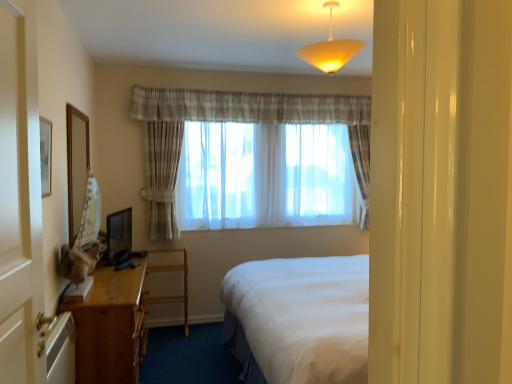
What do you see at coordinates (172, 271) in the screenshot? I see `wooden desk at lower left` at bounding box center [172, 271].

Locate an element on the screen. matte yellow glass lampshade at upper center is located at coordinates (330, 49).

Locate an element on the screen. This screenshot has width=512, height=384. wooden desk at lower left is located at coordinates (172, 271).

From a real-world perspective, is sheer fabric curtains at center on wooden mirror at left?

No, from a real-world perspective, sheer fabric curtains at center is not on top of wooden mirror at left.

Can you confirm if sheer fabric curtains at center is taller than wooden mirror at left?

Yes.

Which object is further away from the camera, sheer fabric curtains at center or wooden mirror at left?

sheer fabric curtains at center is more distant.

Would you say wooden desk at left is a long distance from white wood screen door at left?

Indeed, wooden desk at left is not near white wood screen door at left.

Which object is thinner, wooden desk at left or white wood screen door at left?

With smaller width is white wood screen door at left.

Considering the sizes of objects wooden desk at left and white wood screen door at left in the image provided, who is bigger, wooden desk at left or white wood screen door at left?

Bigger between the two is wooden desk at left.

The height and width of the screenshot is (384, 512). What are the coordinates of `screen door in front of the wooden desk at left` in the screenshot? It's located at click(20, 199).

Would you say wooden desk at lower left is to the left or to the right of white wood screen door at left in the picture?

In the image, wooden desk at lower left appears on the left side of white wood screen door at left.

In terms of size, does wooden desk at lower left appear bigger or smaller than white wood screen door at left?

Considering their sizes, wooden desk at lower left takes up more space than white wood screen door at left.

Is wooden desk at lower left oriented towards white wood screen door at left?

Yes, wooden desk at lower left is aimed at white wood screen door at left.

Which is behind, point (187, 305) or point (34, 70)?

The point (187, 305) is more distant.

Considering the points (73, 177) and (153, 297), which point is behind, point (73, 177) or point (153, 297)?

The point (153, 297) is more distant.

Considering the sizes of wooden mirror at left and wooden desk at lower left in the image, is wooden mirror at left wider or thinner than wooden desk at lower left?

Considering their sizes, wooden mirror at left looks slimmer than wooden desk at lower left.

Is wooden mirror at left not inside wooden desk at lower left?

Absolutely, wooden mirror at left is external to wooden desk at lower left.

Is white wood screen door at left facing away from wooden desk at lower left?

No.

Which is closer, (38,315) or (185,321)?

Point (38,315) is closer to the camera than point (185,321).

From a real-world perspective, is white wood screen door at left under wooden desk at lower left?

No, from a real-world perspective, white wood screen door at left is not beneath wooden desk at lower left.

Who is taller, white wood screen door at left or wooden desk at lower left?

white wood screen door at left.

Would you say white wood screen door at left is a long distance from wooden mirror at left?

That's right, there is a large distance between white wood screen door at left and wooden mirror at left.

From a real-world perspective, is white wood screen door at left positioned above or below wooden mirror at left?

Clearly, from a real-world perspective, white wood screen door at left is below wooden mirror at left.

Between white wood screen door at left and wooden mirror at left, which one has smaller width?

wooden mirror at left is thinner.

Considering the sizes of white wood screen door at left and wooden mirror at left in the image, is white wood screen door at left taller or shorter than wooden mirror at left?

Considering their sizes, white wood screen door at left has more height than wooden mirror at left.

In terms of width, does matte yellow glass lampshade at upper center look wider or thinner when compared to white wood screen door at left?

Clearly, matte yellow glass lampshade at upper center has more width compared to white wood screen door at left.

This screenshot has width=512, height=384. Identify the location of lamp above the white wood screen door at left (from the image's perspective). (330, 49).

Based on the photo, how different are the orientations of matte yellow glass lampshade at upper center and white wood screen door at left in degrees?

88.5 degrees separate the facing orientations of matte yellow glass lampshade at upper center and white wood screen door at left.

Is matte yellow glass lampshade at upper center far away from white wood screen door at left?

That's right, there is a large distance between matte yellow glass lampshade at upper center and white wood screen door at left.

Identify the location of picture frame that appears in front of the sheer fabric curtains at center. The width and height of the screenshot is (512, 384). (76, 166).

At what (x,y) coordinates should I click in order to perform the action: click on screen door above the wooden desk at left (from a real-world perspective). Please return your answer as a coordinate pair (x, y). Image resolution: width=512 pixels, height=384 pixels. Looking at the image, I should click on (20, 199).

Which object lies further to the anchor point white wood screen door at left, wooden mirror at left or sheer fabric curtains at center?

sheer fabric curtains at center is positioned further to the anchor white wood screen door at left.

Based on their spatial positions, is matte yellow glass lampshade at upper center or white wood screen door at left further from wooden desk at lower left?

Based on the image, white wood screen door at left appears to be further to wooden desk at lower left.

Estimate the real-world distances between objects in this image. Which object is further from wooden desk at lower left, matte yellow glass lampshade at upper center or wooden mirror at left?

The object further to wooden desk at lower left is matte yellow glass lampshade at upper center.

Based on the photo, which object lies nearer to the anchor point wooden desk at left, white wood screen door at left or wooden desk at lower left?

wooden desk at lower left is positioned closer to the anchor wooden desk at left.

Based on their spatial positions, is matte yellow glass lampshade at upper center or sheer fabric curtains at center closer to wooden desk at lower left?

sheer fabric curtains at center is positioned closer to the anchor wooden desk at lower left.

Based on the photo, considering their positions, is wooden desk at lower left positioned further to wooden desk at left than wooden mirror at left?

The object further to wooden desk at left is wooden desk at lower left.

When comparing their distances from sheer fabric curtains at center, does wooden desk at lower left or wooden desk at left seem closer?

Among the two, wooden desk at lower left is located nearer to sheer fabric curtains at center.

Considering their positions, is sheer fabric curtains at center positioned closer to wooden desk at lower left than matte yellow glass lampshade at upper center?

sheer fabric curtains at center lies closer to wooden desk at lower left than the other object.

Find the location of a particular element. This screenshot has width=512, height=384. curtain that lies between matte yellow glass lampshade at upper center and wooden desk at left from top to bottom is located at coordinates (234, 121).

I want to click on picture frame between wooden desk at left and wooden desk at lower left in the front-back direction, so click(x=76, y=166).

In order to click on desk between white wood screen door at left and sheer fabric curtains at center from front to back in this screenshot , I will do `click(110, 327)`.

Find the location of a particular element. desk between white wood screen door at left and wooden mirror at left from front to back is located at coordinates pyautogui.click(x=110, y=327).